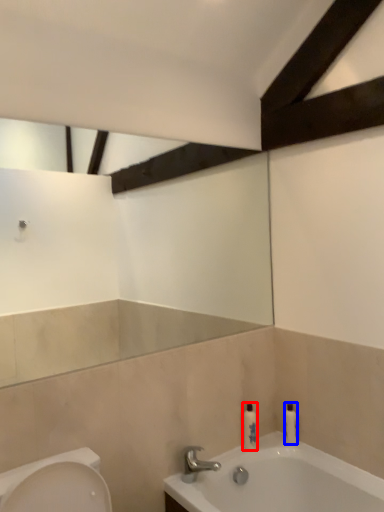
Question: Which object is closer to the camera taking this photo, toiletry (highlighted by a red box) or toiletry (highlighted by a blue box)?

Choices:
 (A) toiletry
 (B) toiletry

Answer: (A)